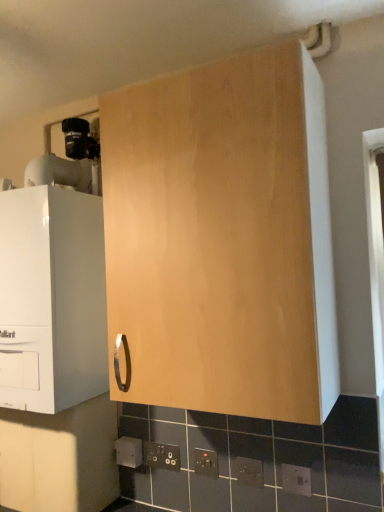
Question: Which direction should I rotate to look at black plastic electric outlet at lower center, positioned as the third electric outlet in back-to-front order, — up or down?

Choices:
 (A) down
 (B) up

Answer: (A)

Question: Considering the relative sizes of black plastic/socket at lower center, which ranks as the 4th electric outlet in back-to-front order, and black plastic electric outlet at lower center, marked as the 3th electric outlet in a left-to-right arrangement, in the image provided, is black plastic/socket at lower center, which ranks as the 4th electric outlet in back-to-front order, smaller than black plastic electric outlet at lower center, marked as the 3th electric outlet in a left-to-right arrangement,?

Choices:
 (A) yes
 (B) no

Answer: (A)

Question: Can you confirm if black plastic/socket at lower center, which ranks as the 4th electric outlet in back-to-front order, is thinner than black plastic electric outlet at lower center, positioned as the third electric outlet in back-to-front order?

Choices:
 (A) no
 (B) yes

Answer: (B)

Question: From the image's perspective, is black plastic/socket at lower center, marked as the 2th electric outlet in a right-to-left arrangement, located beneath black plastic electric outlet at lower center, positioned as the third electric outlet in back-to-front order?

Choices:
 (A) yes
 (B) no

Answer: (B)

Question: Is black plastic/socket at lower center, marked as the 2th electric outlet in a right-to-left arrangement, bigger than black plastic electric outlet at lower center, which ranks as the 3th electric outlet in right-to-left order?

Choices:
 (A) no
 (B) yes

Answer: (A)

Question: Is black plastic/socket at lower center, placed as the 2th electric outlet when sorted from front to back, positioned far away from black plastic electric outlet at lower center, acting as the 3th electric outlet starting from the front?

Choices:
 (A) no
 (B) yes

Answer: (A)

Question: From the image's perspective, is black plastic/socket at lower center, which ranks as the fourth electric outlet in left-to-right order, located above black plastic electric outlet at lower center, marked as the 3th electric outlet in a left-to-right arrangement?

Choices:
 (A) yes
 (B) no

Answer: (A)

Question: Is matte white boiler at left, arranged as the 1th cabinetry when viewed from the left, completely or partially inside matte black electric outlet at lower center, arranged as the fifth electric outlet when viewed from the left?

Choices:
 (A) yes
 (B) no

Answer: (B)

Question: From the image's perspective, would you say matte black electric outlet at lower center, which ranks as the 1th electric outlet in front-to-back order, is positioned over matte white boiler at left, arranged as the 1th cabinetry when viewed from the left?

Choices:
 (A) yes
 (B) no

Answer: (B)

Question: Is matte black electric outlet at lower center, arranged as the fifth electric outlet when viewed from the left, wider than matte white boiler at left, arranged as the 1th cabinetry when viewed from the left?

Choices:
 (A) no
 (B) yes

Answer: (A)

Question: Considering the relative positions of matte black electric outlet at lower center, arranged as the fifth electric outlet when viewed from the left, and matte white boiler at left, arranged as the 1th cabinetry when viewed from the left, in the image provided, is matte black electric outlet at lower center, arranged as the fifth electric outlet when viewed from the left, to the right of matte white boiler at left, arranged as the 1th cabinetry when viewed from the left, from the viewer's perspective?

Choices:
 (A) yes
 (B) no

Answer: (A)

Question: From the image's perspective, is matte black electric outlet at lower center, the fifth electric outlet in the back-to-front sequence, below matte white boiler at left, which is counted as the third cabinetry, starting from the right?

Choices:
 (A) no
 (B) yes

Answer: (B)

Question: Is matte black electric outlet at lower center, the fifth electric outlet in the back-to-front sequence, beside matte white boiler at left, arranged as the 1th cabinetry when viewed from the left?

Choices:
 (A) no
 (B) yes

Answer: (A)

Question: Does light wood cabinet at center, acting as the 3th cabinetry starting from the left, have a greater height compared to matte wood cabinet at lower left, which is counted as the 2th cabinetry, starting from the left?

Choices:
 (A) yes
 (B) no

Answer: (A)